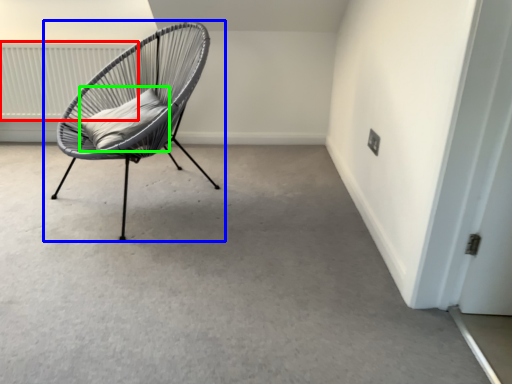
Question: Which object is the farthest from radiator (highlighted by a red box)? Choose among these: chair (highlighted by a blue box) or pillow (highlighted by a green box).

Choices:
 (A) chair
 (B) pillow

Answer: (B)